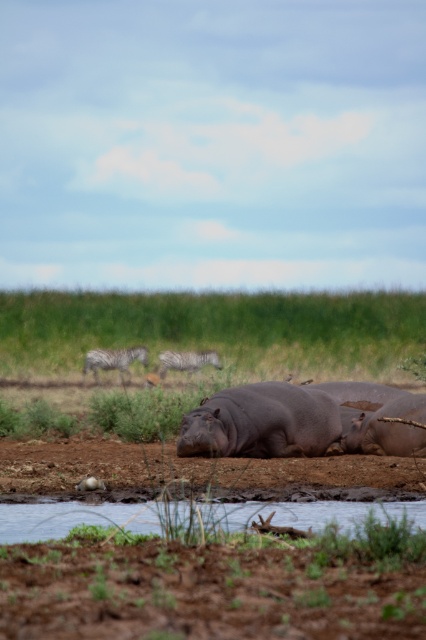
Is green grass at center to the left of gray striped zebra at center from the viewer's perspective?

No, green grass at center is not to the left of gray striped zebra at center.

Which is more to the right, green grass at center or gray striped zebra at center?

green grass at center

Measure the distance between point (2,364) and camera.

The distance of point (2,364) from camera is 122.74 feet.

You are a GUI agent. You are given a task and a screenshot of the screen. Output one action in this format:
    pyautogui.click(x=<x>, y=<y>)
    Task: Click on the green grass at center
    
    Given the screenshot: What is the action you would take?
    (x=215, y=326)

Which of these two, green grass at center or white-striped zebra at center, stands taller?

Standing taller between the two is green grass at center.

The height and width of the screenshot is (640, 426). What do you see at coordinates (215, 326) in the screenshot?
I see `green grass at center` at bounding box center [215, 326].

Is point (80, 312) positioned behind point (192, 364)?

That is True.

This screenshot has width=426, height=640. Identify the location of green grass at center. (215, 326).

Describe the element at coordinates (86, 518) in the screenshot. The width and height of the screenshot is (426, 640). I see `clear water at lower center` at that location.

Locate an element on the screen. Image resolution: width=426 pixels, height=640 pixels. clear water at lower center is located at coordinates (86, 518).

Find the location of a particular element. This screenshot has height=640, width=426. clear water at lower center is located at coordinates (86, 518).